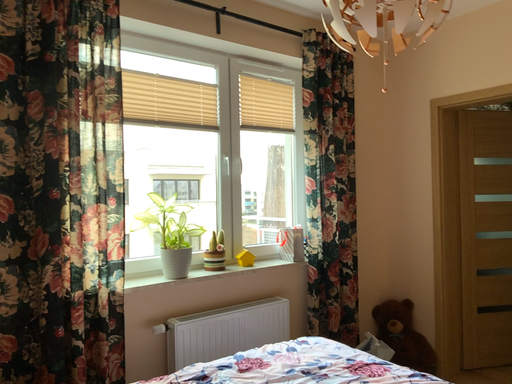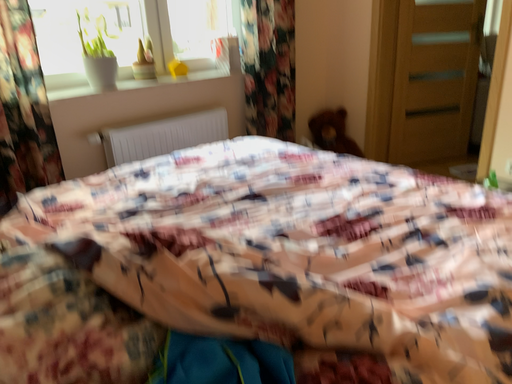
Question: How did the camera likely rotate when shooting the video?

Choices:
 (A) rotated upward
 (B) rotated downward

Answer: (B)